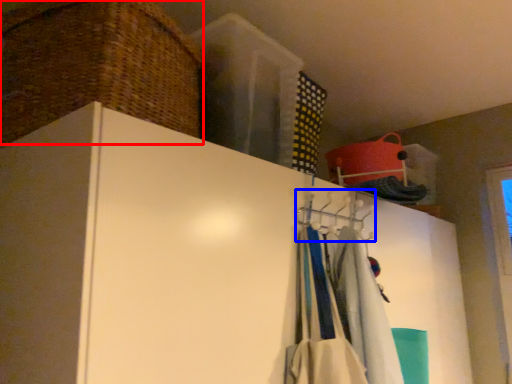
Question: Which object appears farthest to the camera in this image, basket (highlighted by a red box) or hanger (highlighted by a blue box)?

Choices:
 (A) basket
 (B) hanger

Answer: (B)